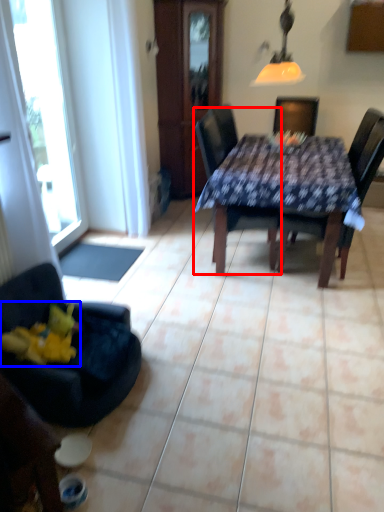
Question: Among these objects, which one is nearest to the camera, chair (highlighted by a red box) or toy (highlighted by a blue box)?

Choices:
 (A) chair
 (B) toy

Answer: (B)